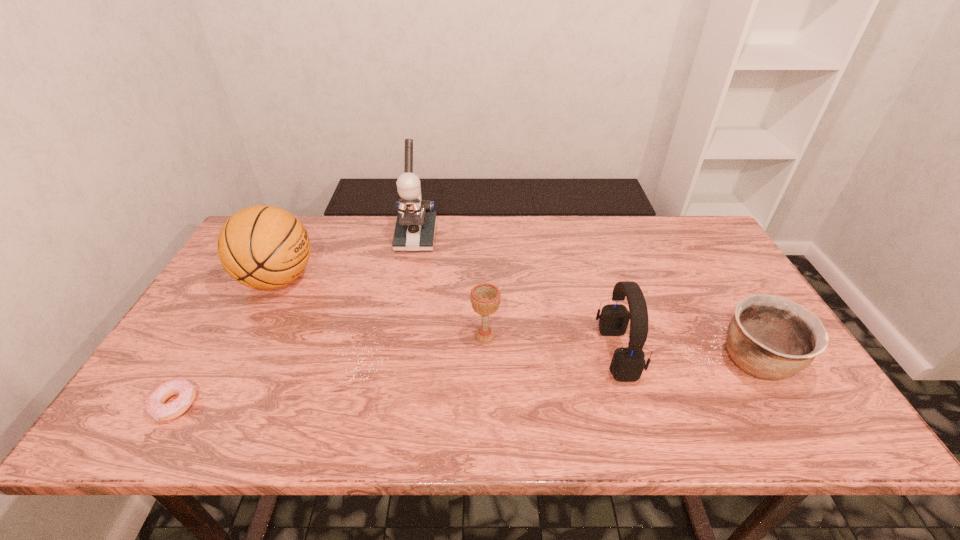
Find the location of `object that is at the right edge`. object that is at the right edge is located at coordinates (770, 337).

This screenshot has height=540, width=960. Find the location of `object located in the far left corner section of the desktop`. object located in the far left corner section of the desktop is located at coordinates (263, 247).

I want to click on object at the near left corner, so tap(155, 406).

Locate an element on the screen. This screenshot has height=540, width=960. free space at the far edge of the desktop is located at coordinates (548, 253).

At what (x,y) coordinates should I click in order to perform the action: click on free region at the near edge. Please return your answer as a coordinate pair (x, y). Looking at the image, I should click on pyautogui.click(x=299, y=413).

This screenshot has width=960, height=540. In order to click on free region at the left edge of the desktop in this screenshot , I will do `click(251, 292)`.

Where is `vacant region at the right edge of the desktop`? vacant region at the right edge of the desktop is located at coordinates (699, 261).

In the image, there is a desktop. Where is `vacant space at the far right corner`? vacant space at the far right corner is located at coordinates (714, 240).

Locate an element on the screen. This screenshot has height=540, width=960. blank region between the chalice and the headset is located at coordinates (551, 345).

The height and width of the screenshot is (540, 960). In order to click on free point between the second object from right to left and the farthest object in this screenshot , I will do `click(516, 295)`.